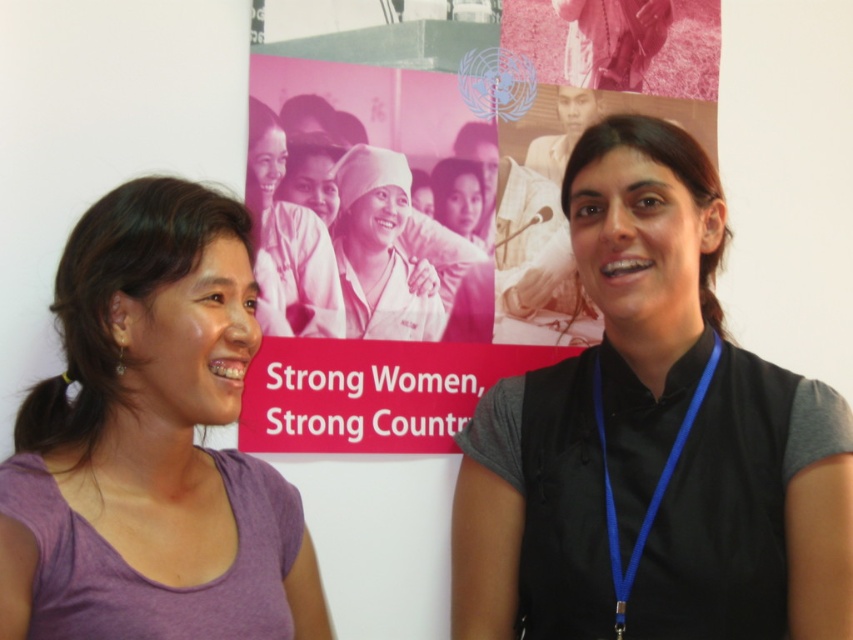
You are a photographer trying to capture a photo of the black fabric vest at center without including the pink glossy poster at center in the frame. Is this possible based on their positions?

The pink glossy poster at center is above the black fabric vest at center, so if you position the camera to focus on the vest while angling it downward, you can exclude the poster from the frame.

You are an event planner trying to determine which item in the scene is larger. You see the pink glossy poster at center and the matte pink uniform at center. Which one has a larger size?

The pink glossy poster at center is bigger than the matte pink uniform at center, so the pink glossy poster at center is larger.

You are a photographer trying to capture a clear shot of the blue fabric lanyard at right and the matte pink uniform at center. Since you want to focus on the lanyard, which object should you adjust your camera to focus on first?

The blue fabric lanyard at right is located below the matte pink uniform at center, so you should focus on the blue fabric lanyard at right first as it is lower in the frame.